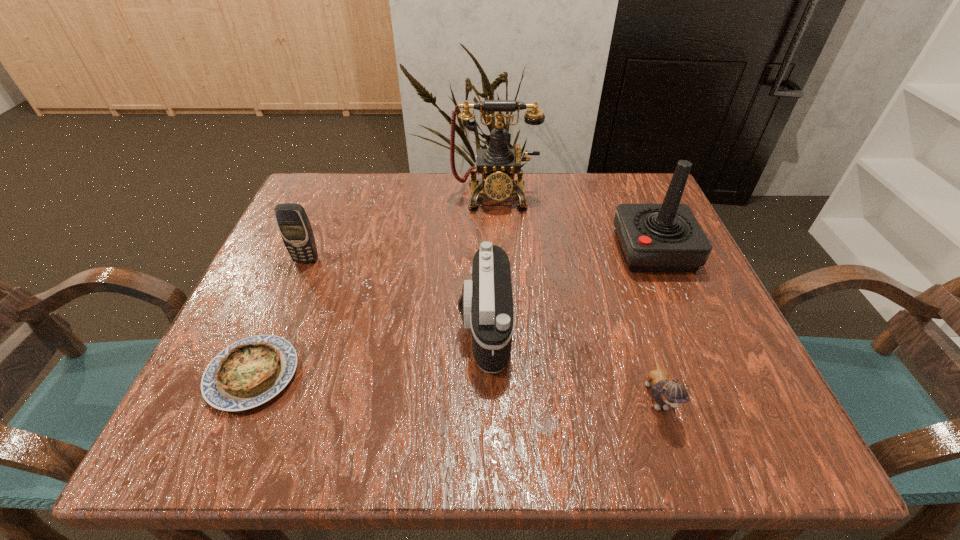
Where is `vacant space situated 0.190m on the front face of the cellular telephone`? Image resolution: width=960 pixels, height=540 pixels. vacant space situated 0.190m on the front face of the cellular telephone is located at coordinates (274, 338).

Identify the location of free space located 0.370m on the front lens of the camera. This screenshot has height=540, width=960. (250, 326).

Find the location of a particular element. free space located on the front lens of the camera is located at coordinates (374, 326).

The image size is (960, 540). Find the location of `free location located on the front lens of the camera`. free location located on the front lens of the camera is located at coordinates (300, 326).

Locate an element on the screen. This screenshot has height=540, width=960. vacant space located on the right of the quiche is located at coordinates pos(378,374).

In order to click on telephone that is at the far edge in this screenshot , I will do `click(498, 164)`.

The width and height of the screenshot is (960, 540). Find the location of `joystick present at the far edge`. joystick present at the far edge is located at coordinates (667, 237).

Locate an element on the screen. The height and width of the screenshot is (540, 960). kitten that is at the near edge is located at coordinates (666, 392).

Where is `quiche situated at the near edge`? This screenshot has height=540, width=960. quiche situated at the near edge is located at coordinates (249, 372).

What are the coordinates of `cellular telephone that is at the left edge` in the screenshot? It's located at (294, 226).